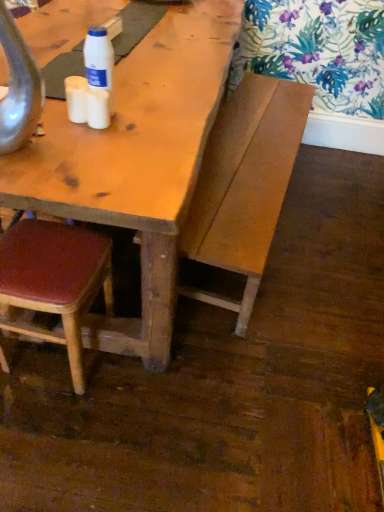
What are the coordinates of `blank space situated above leatherette chair at lower left (from a real-world perspective)` in the screenshot? It's located at (45, 256).